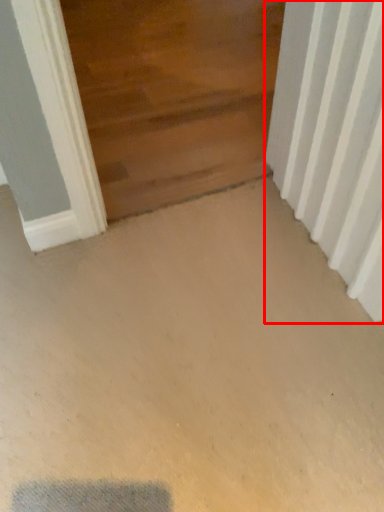
Question: From the image, what is the correct spatial relationship of radiator (annotated by the red box) in relation to door?

Choices:
 (A) left
 (B) right

Answer: (B)